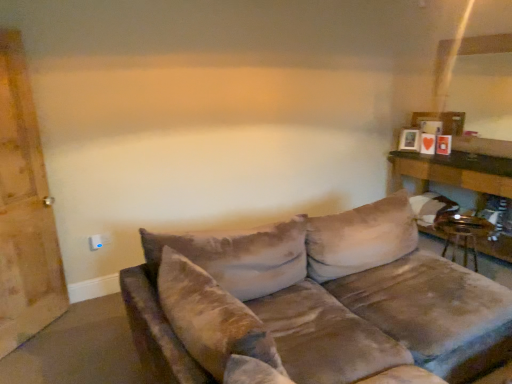
Question: Based on their positions, is matte wooden picture frame at upper right located to the left or right of white plastic electric outlet at lower left?

Choices:
 (A) left
 (B) right

Answer: (B)

Question: Would you say matte wooden picture frame at upper right is inside or outside white plastic electric outlet at lower left?

Choices:
 (A) inside
 (B) outside

Answer: (B)

Question: Estimate the real-world distances between objects in this image. Which object is farther from the matte wooden picture frame at upper right?

Choices:
 (A) velvet brown couch at center
 (B) wooden barn door at left
 (C) white plastic electric outlet at lower left
 (D) wooden table at right

Answer: (B)

Question: Which is farther from the matte wooden picture frame at upper right?

Choices:
 (A) velvet brown couch at center
 (B) wooden table at right
 (C) wooden barn door at left
 (D) white plastic electric outlet at lower left

Answer: (C)